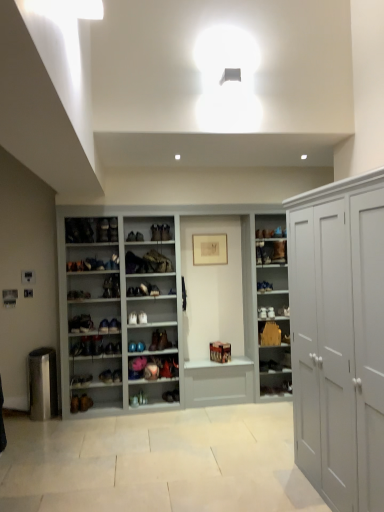
At what (x,y) coordinates should I click in order to perform the action: click on white matte shoe rack at center. Please return your answer as a coordinate pair (x, y). Looking at the image, I should click on (151, 311).

Locate an element on the screen. This screenshot has width=384, height=512. matte brown leather shoe at center, which appears as the 9th shoe when ordered from the bottom is located at coordinates (131, 292).

Measure the distance between shiny brown leather shoe at center, marked as the eighth shoe in a top-to-bottom arrangement, and camera.

The distance of shiny brown leather shoe at center, marked as the eighth shoe in a top-to-bottom arrangement, from camera is 15.02 feet.

Describe the element at coordinates (97, 345) in the screenshot. I see `shiny brown leather shoe at center, which ranks as the third shoe in bottom-to-top order` at that location.

Find the location of a particular element. This screenshot has width=384, height=512. white matte shoe rack at center is located at coordinates (151, 311).

From the picture: Do you think shiny brown leather shoe at center, the first shoe in the bottom-to-top sequence, is within shiny brown leather shoe at center, arranged as the seventh shoe when ordered from the bottom, or outside of it?

shiny brown leather shoe at center, the first shoe in the bottom-to-top sequence, is spatially situated outside shiny brown leather shoe at center, arranged as the seventh shoe when ordered from the bottom.

From the image's perspective, which is below, shiny brown leather shoe at center, which ranks as the 10th shoe in top-to-bottom order, or shiny brown leather shoe at center, arranged as the seventh shoe when ordered from the bottom?

shiny brown leather shoe at center, which ranks as the 10th shoe in top-to-bottom order, appears lower in the image.

Is shiny brown leather shoe at center, the first shoe in the bottom-to-top sequence, not near shiny brown leather shoe at center, placed as the 4th shoe when sorted from top to bottom?

No, shiny brown leather shoe at center, the first shoe in the bottom-to-top sequence, is in close proximity to shiny brown leather shoe at center, placed as the 4th shoe when sorted from top to bottom.

Considering the relative sizes of shiny brown leather shoe at center, the first shoe in the bottom-to-top sequence, and shiny brown leather shoe at center, placed as the 4th shoe when sorted from top to bottom, in the image provided, is shiny brown leather shoe at center, the first shoe in the bottom-to-top sequence, taller than shiny brown leather shoe at center, placed as the 4th shoe when sorted from top to bottom,?

No.

Considering the sizes of objects white matte shoe rack at center and white matte cabinet at right in the image provided, who is bigger, white matte shoe rack at center or white matte cabinet at right?

white matte shoe rack at center.

Is white matte shoe rack at center facing towards white matte cabinet at right?

Yes, white matte shoe rack at center is oriented towards white matte cabinet at right.

How far apart are white matte shoe rack at center and white matte cabinet at right?

white matte shoe rack at center is 6.27 feet from white matte cabinet at right.

From the image's perspective, which is above, white matte shoe rack at center or white matte cabinet at right?

From the image's view, white matte shoe rack at center is above.

Considering the sizes of objects matte brown shoe at center, the 7th shoe in the top-to-bottom sequence, and wooden cabinet at center in the image provided, who is wider, matte brown shoe at center, the 7th shoe in the top-to-bottom sequence, or wooden cabinet at center?

Wider between the two is matte brown shoe at center, the 7th shoe in the top-to-bottom sequence.

From their relative heights in the image, would you say matte brown shoe at center, which is counted as the fourth shoe, starting from the bottom, is taller or shorter than wooden cabinet at center?

Considering their sizes, matte brown shoe at center, which is counted as the fourth shoe, starting from the bottom, has less height than wooden cabinet at center.

From a real-world perspective, between matte brown shoe at center, the 7th shoe in the top-to-bottom sequence, and wooden cabinet at center, who is vertically higher?

wooden cabinet at center.

Is matte brown shoe at center, which is counted as the fourth shoe, starting from the bottom, to the right of white matte cabinet at right from the viewer's perspective?

No.

From the image's perspective, is matte brown shoe at center, the 7th shoe in the top-to-bottom sequence, positioned above or below white matte cabinet at right?

matte brown shoe at center, the 7th shoe in the top-to-bottom sequence, is situated lower than white matte cabinet at right in the image.

Are matte brown shoe at center, which is counted as the fourth shoe, starting from the bottom, and white matte cabinet at right far apart?

Yes.

Can matte brown leather shoe at center, which appears as the 9th shoe when ordered from the bottom, be found inside white matte cabinet at right?

No, white matte cabinet at right does not contain matte brown leather shoe at center, which appears as the 9th shoe when ordered from the bottom.

What's the angular difference between white matte cabinet at right and matte brown leather shoe at center, which appears as the 9th shoe when ordered from the bottom,'s facing directions?

The facing directions of white matte cabinet at right and matte brown leather shoe at center, which appears as the 9th shoe when ordered from the bottom, are 92.6 degrees apart.

Is white matte cabinet at right with matte brown leather shoe at center, positioned as the 2th shoe in top-to-bottom order?

No, white matte cabinet at right is not making contact with matte brown leather shoe at center, positioned as the 2th shoe in top-to-bottom order.

Considering the sizes of white matte cabinet at right and matte brown leather shoe at center, which appears as the 9th shoe when ordered from the bottom, in the image, is white matte cabinet at right taller or shorter than matte brown leather shoe at center, which appears as the 9th shoe when ordered from the bottom,?

white matte cabinet at right is taller than matte brown leather shoe at center, which appears as the 9th shoe when ordered from the bottom.

Which is more to the right, matte white shoe at center, the sixth shoe when ordered from bottom to top, or shiny brown leather shoe at center, which ranks as the 10th shoe in top-to-bottom order?

shiny brown leather shoe at center, which ranks as the 10th shoe in top-to-bottom order.

From the image's perspective, which is below, matte white shoe at center, the sixth shoe when ordered from bottom to top, or shiny brown leather shoe at center, which ranks as the 10th shoe in top-to-bottom order?

shiny brown leather shoe at center, which ranks as the 10th shoe in top-to-bottom order.

Does matte white shoe at center, the sixth shoe when ordered from bottom to top, have a larger size compared to shiny brown leather shoe at center, which ranks as the 10th shoe in top-to-bottom order?

Yes.

Considering the positions of objects matte white shoe at center, the sixth shoe when ordered from bottom to top, and shiny brown leather shoe at center, the first shoe in the bottom-to-top sequence, in the image provided, who is behind, matte white shoe at center, the sixth shoe when ordered from bottom to top, or shiny brown leather shoe at center, the first shoe in the bottom-to-top sequence,?

shiny brown leather shoe at center, the first shoe in the bottom-to-top sequence, is further away from the camera.

Does matte white shoe at center, the sixth shoe when ordered from bottom to top, have a lesser width compared to matte brown shoe at center, the 7th shoe in the top-to-bottom sequence?

In fact, matte white shoe at center, the sixth shoe when ordered from bottom to top, might be wider than matte brown shoe at center, the 7th shoe in the top-to-bottom sequence.

Considering the positions of point (116, 323) and point (154, 335), is point (116, 323) closer or farther from the camera than point (154, 335)?

Clearly, point (116, 323) is closer to the camera than point (154, 335).

What's the angular difference between matte white shoe at center, which appears as the fifth shoe when viewed from the top, and matte brown shoe at center, the 7th shoe in the top-to-bottom sequence,'s facing directions?

The angle between the facing direction of matte white shoe at center, which appears as the fifth shoe when viewed from the top, and the facing direction of matte brown shoe at center, the 7th shoe in the top-to-bottom sequence, is 4.48 degrees.

Is the position of matte white shoe at center, which appears as the fifth shoe when viewed from the top, less distant than that of matte brown shoe at center, which is counted as the fourth shoe, starting from the bottom?

Yes, it is in front of matte brown shoe at center, which is counted as the fourth shoe, starting from the bottom.

Which shoe is the 5th one when counting from the right side of the shiny brown leather shoe at center, placed as the 4th shoe when sorted from top to bottom? Please provide its 2D coordinates.

[(170, 396)]

Find the location of a particular element. The image size is (384, 512). cabinetry below the white matte shoe rack at center (from a real-world perspective) is located at coordinates (339, 339).

Looking at the image, which one is located closer to matte brown boot at center, placed as the third shoe when sorted from top to bottom, matte brown leather shoe at center, which appears as the 9th shoe when ordered from the bottom, or matte black shoe at center, placed as the second shoe when sorted from bottom to top?

Based on the image, matte brown leather shoe at center, which appears as the 9th shoe when ordered from the bottom, appears to be nearer to matte brown boot at center, placed as the third shoe when sorted from top to bottom.

Which object lies nearer to the anchor point matte brown leather shoe at center, positioned as the 2th shoe in top-to-bottom order, white matte cabinet at right or matte white shoe at center, the sixth shoe when ordered from bottom to top?

Among the two, matte white shoe at center, the sixth shoe when ordered from bottom to top, is located nearer to matte brown leather shoe at center, positioned as the 2th shoe in top-to-bottom order.

From the image, which object appears to be farther from shiny brown leather shoe at center, arranged as the seventh shoe when ordered from the bottom, shiny brown leather shoe at center, the first shoe in the bottom-to-top sequence, or matte brown leather shoe at center, which appears as the 9th shoe when ordered from the bottom?

shiny brown leather shoe at center, the first shoe in the bottom-to-top sequence, lies further to shiny brown leather shoe at center, arranged as the seventh shoe when ordered from the bottom, than the other object.

Based on the photo, looking at the image, which one is located closer to matte white shoe at center, the sixth shoe when ordered from bottom to top, shiny brown boot at center, which is the tenth shoe from bottom to top, or shiny brown leather shoe at center, arranged as the seventh shoe when ordered from the bottom?

The object closer to matte white shoe at center, the sixth shoe when ordered from bottom to top, is shiny brown leather shoe at center, arranged as the seventh shoe when ordered from the bottom.

Which object lies further to the anchor point matte white shoe at center, the sixth shoe when ordered from bottom to top, matte brown boot at center, acting as the third footwear starting from the left, or leather boot at center, placed as the second footwear when sorted from bottom to top?

Based on the image, matte brown boot at center, acting as the third footwear starting from the left, appears to be further to matte white shoe at center, the sixth shoe when ordered from bottom to top.

Which object lies further to the anchor point shiny brown leather shoe at center, marked as the eighth shoe in a top-to-bottom arrangement, leather boot at center, placed as the 1th footwear when sorted from left to right, or matte brown leather shoe at center, which appears as the 9th shoe when ordered from the bottom?

leather boot at center, placed as the 1th footwear when sorted from left to right, is positioned further to the anchor shiny brown leather shoe at center, marked as the eighth shoe in a top-to-bottom arrangement.

Looking at the image, which one is located further to matte brown leather shoe at center, which appears as the 9th shoe when ordered from the bottom, white matte cabinet at right or wooden cabinet at center?

The object further to matte brown leather shoe at center, which appears as the 9th shoe when ordered from the bottom, is white matte cabinet at right.

From the picture: Based on their spatial positions, is white matte cabinet at right or matte white shoe at center, the sixth shoe when ordered from bottom to top, closer to matte brown boot at center, placed as the third shoe when sorted from top to bottom?

Among the two, matte white shoe at center, the sixth shoe when ordered from bottom to top, is located nearer to matte brown boot at center, placed as the third shoe when sorted from top to bottom.

Identify the location of footwear between white matte cabinet at right and matte brown boot at center, placed as the first footwear when sorted from bottom to top, in the front-back direction. [x=147, y=263].

Identify the location of picture frame situated between matte brown leather shoe at center, positioned as the 2th shoe in top-to-bottom order, and matte brown boot at center, placed as the first footwear when sorted from bottom to top, from left to right. This screenshot has height=512, width=384. (210, 249).

Image resolution: width=384 pixels, height=512 pixels. I want to click on cupboard between white matte cabinet at right and shiny brown boot at center, which is the tenth shoe from bottom to top, along the z-axis, so click(151, 311).

The image size is (384, 512). Find the location of `shoe between matte brown shoe at center, the 5th shoe in the bottom-to-top sequence, and wooden cabinet at center from left to right`. shoe between matte brown shoe at center, the 5th shoe in the bottom-to-top sequence, and wooden cabinet at center from left to right is located at coordinates (170, 396).